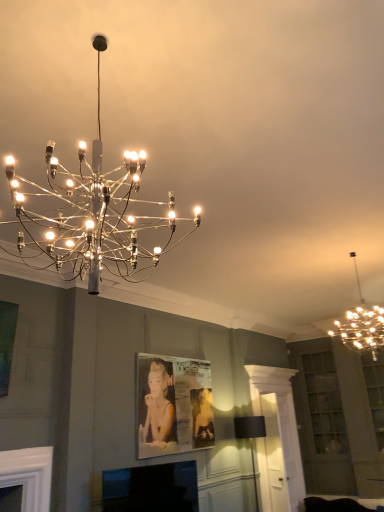
Question: Can you confirm if metallic silver picture frame at center is taller than metallic chandelier at upper right, arranged as the 2th lamp when viewed from the top?

Choices:
 (A) yes
 (B) no

Answer: (A)

Question: Considering the relative sizes of metallic silver picture frame at center and metallic chandelier at upper right, arranged as the 2th lamp when viewed from the top, in the image provided, is metallic silver picture frame at center bigger than metallic chandelier at upper right, arranged as the 2th lamp when viewed from the top,?

Choices:
 (A) no
 (B) yes

Answer: (A)

Question: Is metallic silver picture frame at center at the left side of metallic chandelier at upper right, which ranks as the 3th lamp in left-to-right order?

Choices:
 (A) no
 (B) yes

Answer: (B)

Question: Does metallic silver picture frame at center lie in front of metallic chandelier at upper right, which ranks as the first lamp in right-to-left order?

Choices:
 (A) no
 (B) yes

Answer: (A)

Question: Is metallic silver picture frame at center not near metallic chandelier at upper right, which ranks as the first lamp in right-to-left order?

Choices:
 (A) yes
 (B) no

Answer: (A)

Question: Is metallic silver picture frame at center in front of or behind black fabric lampshade at lower center, placed as the third lamp when sorted from front to back, in the image?

Choices:
 (A) behind
 (B) front

Answer: (B)

Question: In the image, is metallic silver picture frame at center on the left side or the right side of black fabric lampshade at lower center, arranged as the first lamp when ordered from the bottom?

Choices:
 (A) left
 (B) right

Answer: (A)

Question: Is metallic silver picture frame at center inside or outside of black fabric lampshade at lower center, which is the 1th lamp in back-to-front order?

Choices:
 (A) inside
 (B) outside

Answer: (B)

Question: In terms of height, does metallic silver picture frame at center look taller or shorter compared to black fabric lampshade at lower center, which is counted as the second lamp, starting from the right?

Choices:
 (A) tall
 (B) short

Answer: (B)

Question: Do you think black fabric lampshade at lower center, placed as the third lamp when sorted from front to back, is within metallic chandelier at upper right, which ranks as the 3th lamp in left-to-right order, or outside of it?

Choices:
 (A) inside
 (B) outside

Answer: (B)

Question: Considering the positions of black fabric lampshade at lower center, marked as the 2th lamp in a left-to-right arrangement, and metallic chandelier at upper right, arranged as the 2th lamp when viewed from the top, in the image, is black fabric lampshade at lower center, marked as the 2th lamp in a left-to-right arrangement, bigger or smaller than metallic chandelier at upper right, arranged as the 2th lamp when viewed from the top,?

Choices:
 (A) small
 (B) big

Answer: (A)

Question: Is black fabric lampshade at lower center, marked as the 2th lamp in a left-to-right arrangement, taller or shorter than metallic chandelier at upper right, which ranks as the 3th lamp in left-to-right order?

Choices:
 (A) short
 (B) tall

Answer: (B)

Question: Visually, is black fabric lampshade at lower center, which is the 1th lamp in back-to-front order, positioned to the left or to the right of metallic chandelier at upper right, which appears as the second lamp when viewed from the back?

Choices:
 (A) right
 (B) left

Answer: (B)

Question: From the image's perspective, is black glossy tv at lower center positioned above or below metallic chandelier at upper center, which appears as the 3th lamp when viewed from the back?

Choices:
 (A) above
 (B) below

Answer: (B)

Question: Considering their positions, is black glossy tv at lower center located in front of or behind metallic chandelier at upper center, which is counted as the 1th lamp, starting from the top?

Choices:
 (A) front
 (B) behind

Answer: (B)